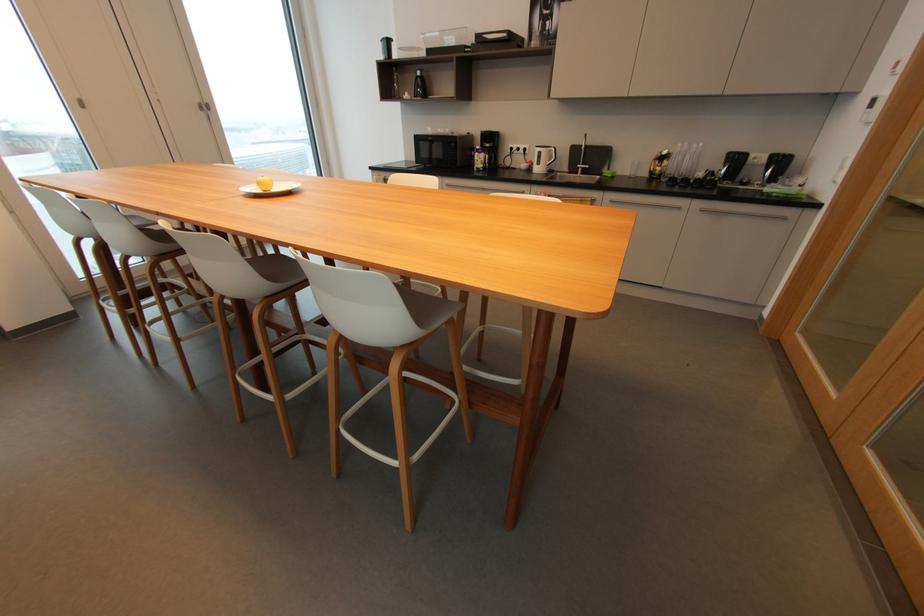
Identify the location of faucet handle. (584, 140).